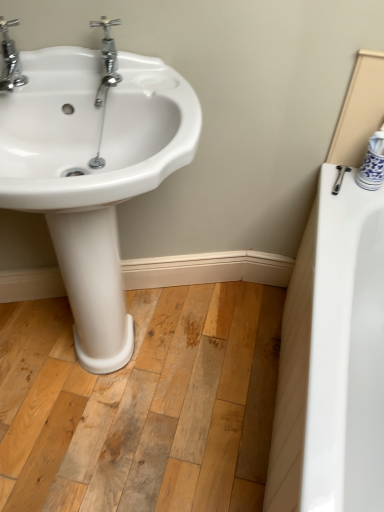
I want to click on free point to the right of chrome/metallic faucet at upper left, the 2th tap in the left-to-right sequence, so click(158, 84).